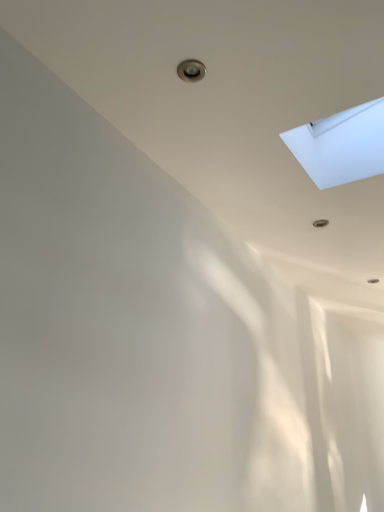
The width and height of the screenshot is (384, 512). What do you see at coordinates (341, 145) in the screenshot?
I see `transparent plastic window at upper right` at bounding box center [341, 145].

In order to face transparent plastic window at upper right, should I rotate leftwards or rightwards?

It's best to rotate right around 20.844 degrees.

Locate an element on the screen. The width and height of the screenshot is (384, 512). transparent plastic window at upper right is located at coordinates (341, 145).

The height and width of the screenshot is (512, 384). I want to click on transparent plastic window at upper right, so click(341, 145).